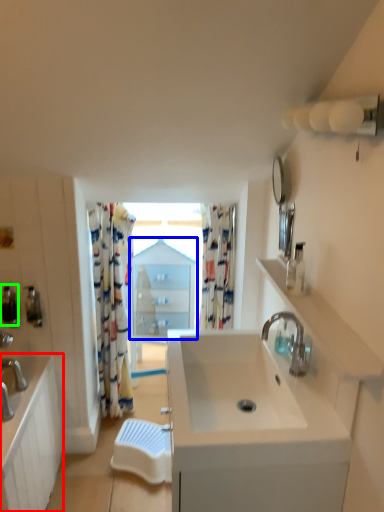
Question: Considering the real-world distances, which object is farthest from bathroom cabinet (highlighted by a red box)? medicine cabinet (highlighted by a blue box) or soap dispenser (highlighted by a green box)?

Choices:
 (A) medicine cabinet
 (B) soap dispenser

Answer: (A)